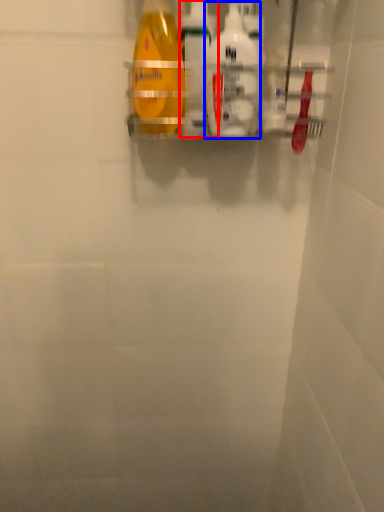
Question: Which of the following is the closest to the observer, cleaning product (highlighted by a red box) or cleaning product (highlighted by a blue box)?

Choices:
 (A) cleaning product
 (B) cleaning product

Answer: (B)